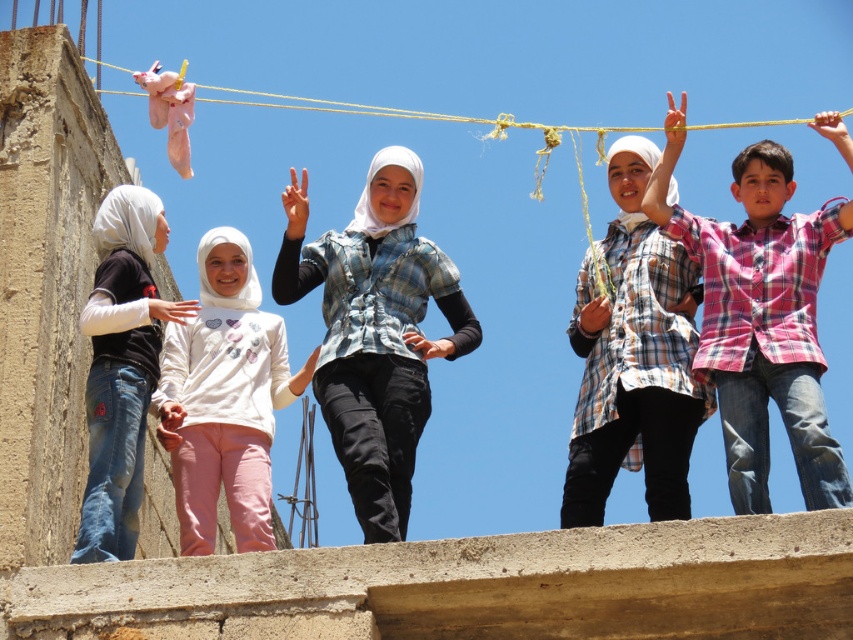
Can you confirm if blue plaid shirt at center is positioned to the right of matte black shirt at left?

Yes, blue plaid shirt at center is to the right of matte black shirt at left.

In the scene shown: Does blue plaid shirt at center have a lesser height compared to matte black shirt at left?

No, blue plaid shirt at center is not shorter than matte black shirt at left.

Who is more distant from viewer, (x=345, y=237) or (x=125, y=216)?

The point (x=345, y=237) is behind.

Where is `blue plaid shirt at center`? The height and width of the screenshot is (640, 853). blue plaid shirt at center is located at coordinates (375, 332).

Does white soft sweater at center appear on the left side of matte black shirt at left?

No, white soft sweater at center is not to the left of matte black shirt at left.

Is white soft sweater at center bigger than matte black shirt at left?

Yes.

You are a GUI agent. You are given a task and a screenshot of the screen. Output one action in this format:
    pyautogui.click(x=<x>, y=<y>)
    Task: Click on the white soft sweater at center
    This screenshot has width=853, height=640.
    Given the screenshot: What is the action you would take?
    pyautogui.click(x=224, y=400)

Is blue plaid shirt at center behind yellow rope at upper center?

That is False.

Is point (383, 160) positioned after point (279, 102)?

No, it is in front of (279, 102).

Locate an element on the screen. The image size is (853, 640). blue plaid shirt at center is located at coordinates (375, 332).